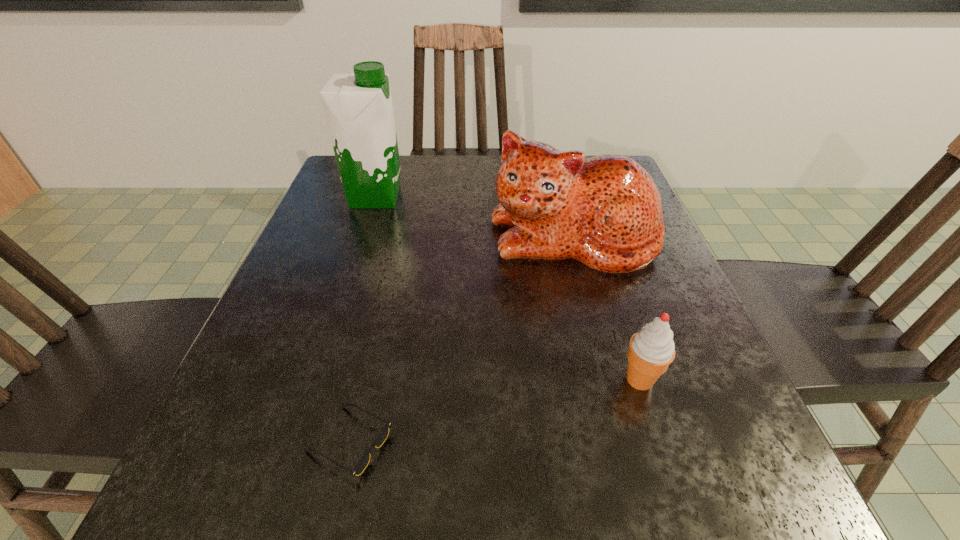
What are the coordinates of `empty location between the second nearest object and the second tallest object` in the screenshot? It's located at (607, 308).

Find the location of a particular element. blank region between the soya milk and the cat is located at coordinates (474, 217).

The image size is (960, 540). In order to click on the closest object to the shortest object in this screenshot , I will do `click(605, 211)`.

In order to click on the second closest object to the tallest object in this screenshot , I will do `click(380, 439)`.

This screenshot has width=960, height=540. I want to click on free space that satisfies the following two spatial constraints: 1. on the face of the cat; 2. on the lenses of the nearest object, so click(x=627, y=442).

Locate an element on the screen. This screenshot has height=540, width=960. free space that satisfies the following two spatial constraints: 1. on the front-facing side of the third tallest object; 2. on the right side of the tallest object is located at coordinates (315, 380).

You are a GUI agent. You are given a task and a screenshot of the screen. Output one action in this format:
    pyautogui.click(x=<x>, y=<y>)
    Task: Click on the vacant point that satisfies the following two spatial constraints: 1. on the back side of the icecream; 2. on the front-facing side of the soya milk
    
    Given the screenshot: What is the action you would take?
    pyautogui.click(x=582, y=197)

At what (x,y) coordinates should I click in order to perform the action: click on vacant space that satisfies the following two spatial constraints: 1. on the face of the third tallest object; 2. on the right side of the third shortest object. Please return your answer as a coordinate pair (x, y). This screenshot has height=540, width=960. Looking at the image, I should click on (611, 380).

This screenshot has width=960, height=540. I want to click on vacant space that satisfies the following two spatial constraints: 1. on the face of the third tallest object; 2. on the right side of the second tallest object, so click(x=611, y=380).